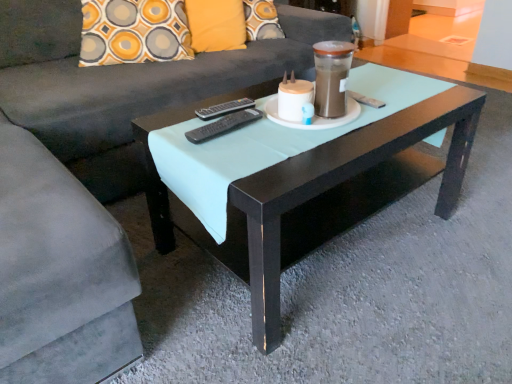
At what (x,y) coordinates should I click in order to perform the action: click on unoccupied region to the right of transparent glass beverage at center. Please return your answer as a coordinate pair (x, y). This screenshot has width=512, height=384. Looking at the image, I should click on (379, 115).